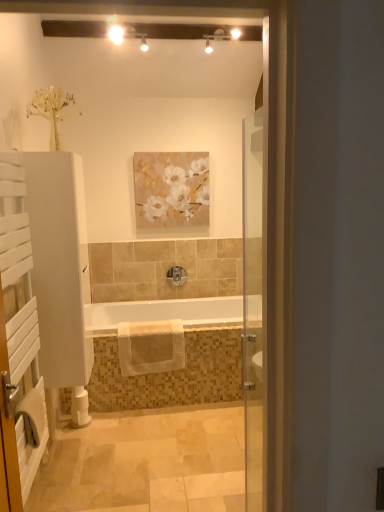
Find the location of a particular element. This screenshot has width=384, height=512. empty space that is ontop of beige textured towel at center, which is counted as the 1th bath towel, starting from the back (from a real-world perspective) is located at coordinates (158, 321).